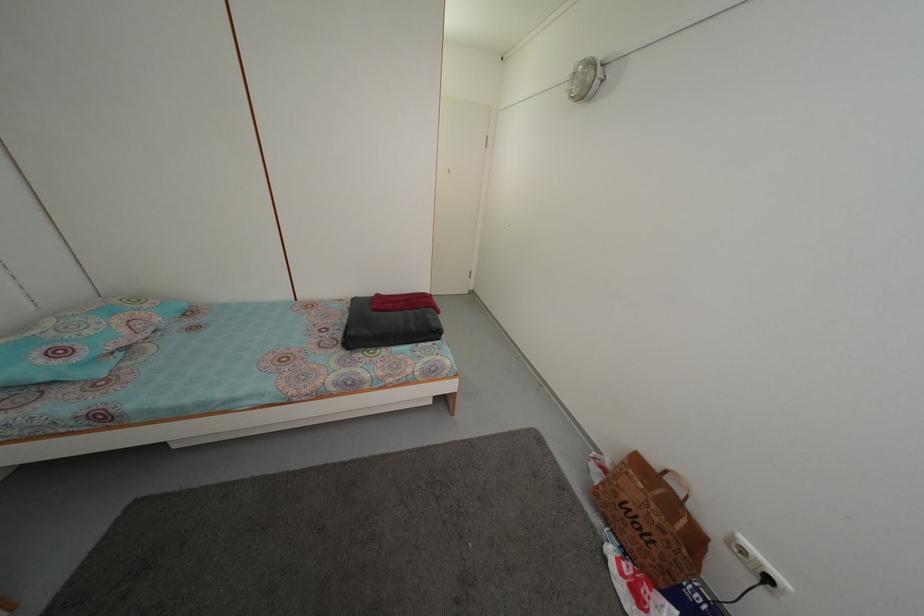
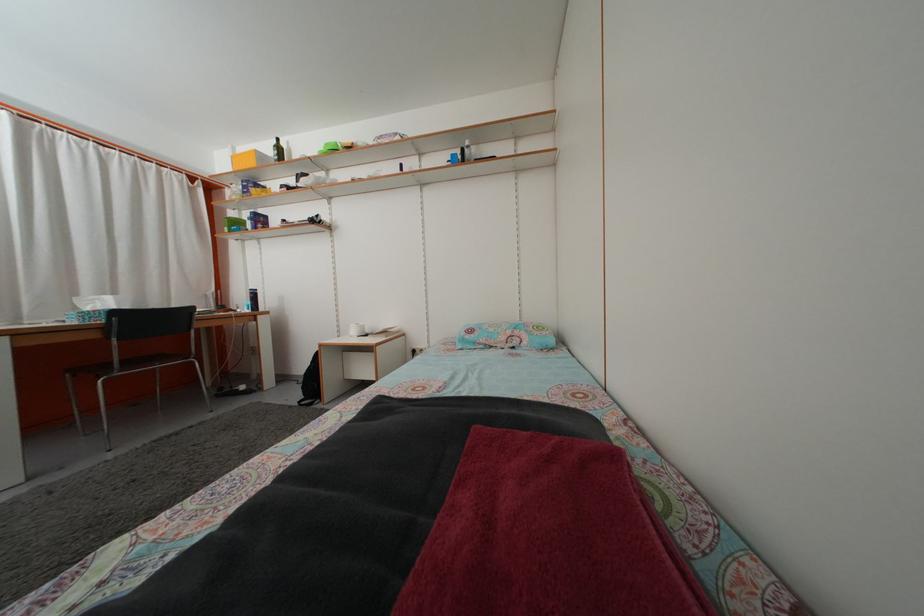
In the second image, find the point that corresponds to [129,338] in the first image.

(508, 346)